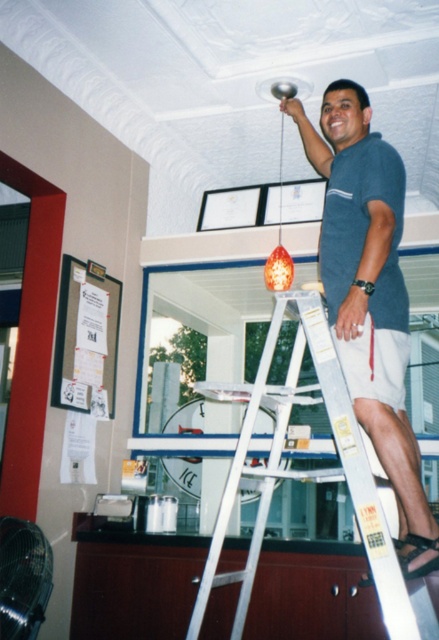
Does white metallic ladder at center have a greater width compared to orange glass pendant at upper center?

Yes.

Can you confirm if white metallic ladder at center is shorter than orange glass pendant at upper center?

In fact, white metallic ladder at center may be taller than orange glass pendant at upper center.

Which is behind, point (326, 385) or point (276, 260)?

The point (276, 260) is behind.

Where is `white metallic ladder at center`? The width and height of the screenshot is (439, 640). white metallic ladder at center is located at coordinates pos(308,472).

Consider the image. Who is more forward, (309, 131) or (244, 621)?

Point (244, 621) is more forward.

Who is lower down, blue cotton shirt at upper center or white metallic ladder at center?

white metallic ladder at center is below.

Between point (356, 93) and point (233, 582), which one is positioned behind?

Point (233, 582)

Locate an element on the screen. blue cotton shirt at upper center is located at coordinates (370, 292).

Does blue cotton shirt at upper center appear over orange glass pendant at upper center?

No.

Is blue cotton shirt at upper center taller than orange glass pendant at upper center?

Indeed, blue cotton shirt at upper center has a greater height compared to orange glass pendant at upper center.

Measure the distance between point (x=328, y=179) and camera.

Point (x=328, y=179) is 2.46 meters away from camera.

At what (x,y) coordinates should I click in order to perform the action: click on blue cotton shirt at upper center. Please return your answer as a coordinate pair (x, y). Looking at the image, I should click on (370, 292).